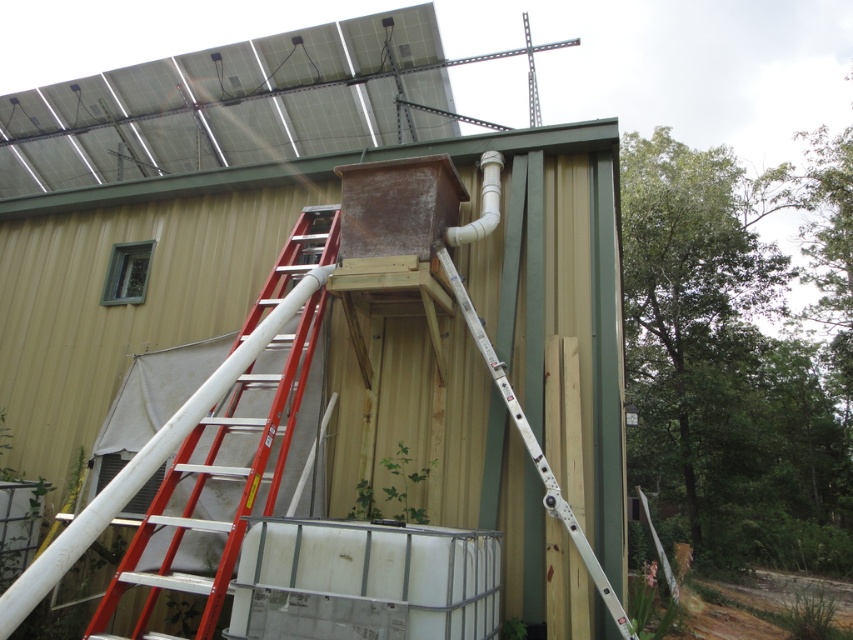
Question: Among these points, which one is farthest from the camera?

Choices:
 (A) (178, 468)
 (B) (550, 508)

Answer: (A)

Question: Where is rusty metal box at center located in relation to red metallic ladder at left in the image?

Choices:
 (A) above
 (B) below

Answer: (A)

Question: Which point is closer to the camera?

Choices:
 (A) white plastic pipe at upper right
 (B) red metallic ladder at left
 (C) white metallic ladder at center

Answer: (B)

Question: Is white metallic ladder at center further to the viewer compared to white plastic pipe at upper right?

Choices:
 (A) no
 (B) yes

Answer: (A)

Question: Which of the following is the closest to the observer?

Choices:
 (A) white plastic pipe at upper right
 (B) white metallic ladder at center
 (C) red metallic ladder at left

Answer: (C)

Question: Where is rusty metal box at center located in relation to white plastic pipe at upper right in the image?

Choices:
 (A) left
 (B) right

Answer: (A)